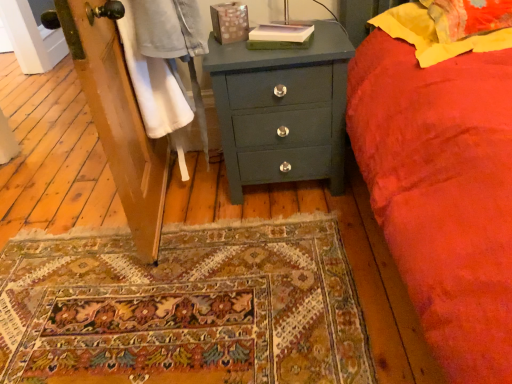
Question: From the image's perspective, is yellow fabric pillow at upper right, arranged as the second pillow when ordered from the bottom, over matte green chest of drawers at center?

Choices:
 (A) yes
 (B) no

Answer: (A)

Question: Is yellow fabric pillow at upper right, arranged as the second pillow when ordered from the bottom, taller than matte green chest of drawers at center?

Choices:
 (A) no
 (B) yes

Answer: (A)

Question: Considering the relative sizes of yellow fabric pillow at upper right, arranged as the second pillow when ordered from the bottom, and matte green chest of drawers at center in the image provided, is yellow fabric pillow at upper right, arranged as the second pillow when ordered from the bottom, wider than matte green chest of drawers at center?

Choices:
 (A) no
 (B) yes

Answer: (B)

Question: Is yellow fabric pillow at upper right, arranged as the second pillow when ordered from the bottom, shorter than matte green chest of drawers at center?

Choices:
 (A) no
 (B) yes

Answer: (B)

Question: From the image's perspective, is yellow fabric pillow at upper right, arranged as the second pillow when ordered from the bottom, under matte green chest of drawers at center?

Choices:
 (A) yes
 (B) no

Answer: (B)

Question: Looking at the image, does matte green chest of drawers at center seem bigger or smaller compared to yellow fabric pillow at upper right, which is the first pillow from top to bottom?

Choices:
 (A) small
 (B) big

Answer: (B)

Question: Considering the relative positions of matte green chest of drawers at center and yellow fabric pillow at upper right, arranged as the second pillow when ordered from the bottom, in the image provided, is matte green chest of drawers at center to the left or to the right of yellow fabric pillow at upper right, arranged as the second pillow when ordered from the bottom,?

Choices:
 (A) left
 (B) right

Answer: (A)

Question: From a real-world perspective, is matte green chest of drawers at center physically located above or below yellow fabric pillow at upper right, arranged as the second pillow when ordered from the bottom?

Choices:
 (A) above
 (B) below

Answer: (B)

Question: In the image, is matte green chest of drawers at center positioned in front of or behind yellow fabric pillow at upper right, arranged as the second pillow when ordered from the bottom?

Choices:
 (A) front
 (B) behind

Answer: (B)

Question: Considering the positions of point (414, 39) and point (320, 117), is point (414, 39) closer or farther from the camera than point (320, 117)?

Choices:
 (A) farther
 (B) closer

Answer: (B)

Question: Considering the positions of yellow fabric pillow at upper right, the 2th pillow viewed from the top, and matte green chest of drawers at center in the image, is yellow fabric pillow at upper right, the 2th pillow viewed from the top, taller or shorter than matte green chest of drawers at center?

Choices:
 (A) short
 (B) tall

Answer: (A)

Question: Based on their sizes in the image, would you say yellow fabric pillow at upper right, which appears as the 1th pillow when ordered from the bottom, is bigger or smaller than matte green chest of drawers at center?

Choices:
 (A) small
 (B) big

Answer: (A)

Question: In the image, is yellow fabric pillow at upper right, which appears as the 1th pillow when ordered from the bottom, positioned in front of or behind matte green chest of drawers at center?

Choices:
 (A) front
 (B) behind

Answer: (A)

Question: Considering the positions of yellow fabric pillow at upper right, arranged as the second pillow when ordered from the bottom, and yellow fabric pillow at upper right, which appears as the 1th pillow when ordered from the bottom, in the image, is yellow fabric pillow at upper right, arranged as the second pillow when ordered from the bottom, wider or thinner than yellow fabric pillow at upper right, which appears as the 1th pillow when ordered from the bottom,?

Choices:
 (A) thin
 (B) wide

Answer: (A)

Question: Visually, is yellow fabric pillow at upper right, arranged as the second pillow when ordered from the bottom, positioned to the left or to the right of yellow fabric pillow at upper right, the 2th pillow viewed from the top?

Choices:
 (A) right
 (B) left

Answer: (A)